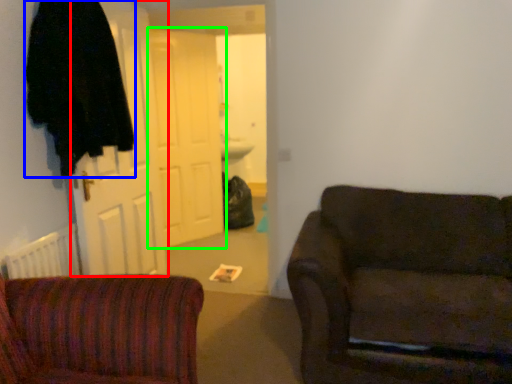
Question: Which object is positioned farthest from door (highlighted by a red box)? Select from robe (highlighted by a blue box) and door (highlighted by a green box).

Choices:
 (A) robe
 (B) door

Answer: (B)